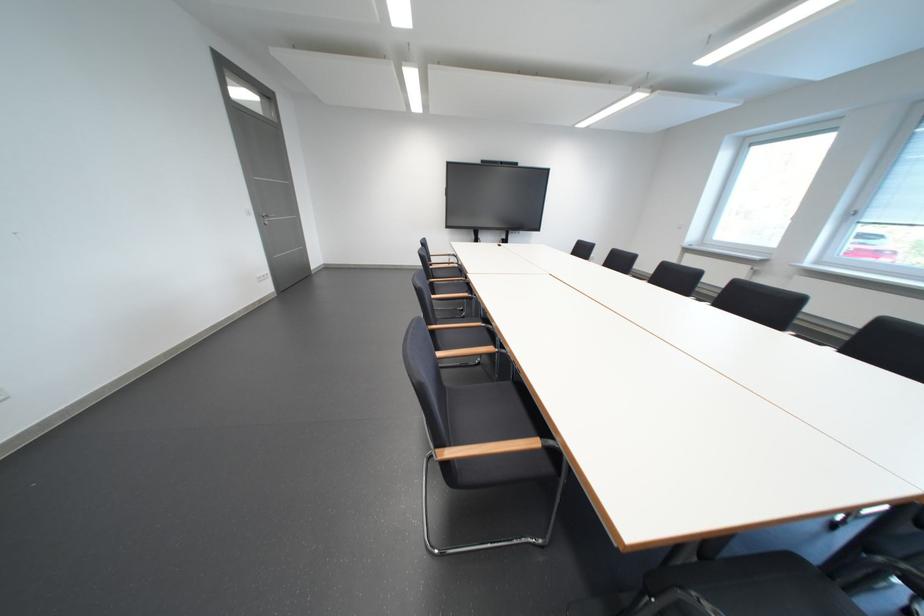
Where would you resting arm the wooden chair armrest? Please return your answer as a coordinate pair (x, y).

(492, 448)